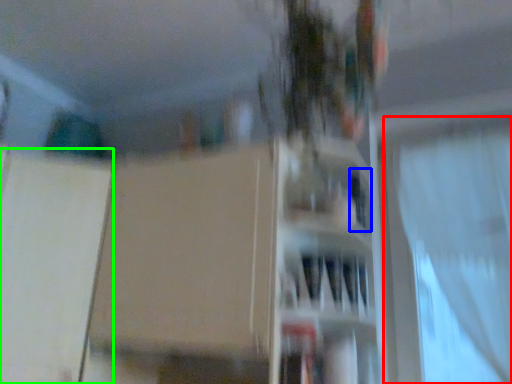
Question: Which object is the farthest from curtain (highlighted by a red box)? Choose among these: window (highlighted by a blue box) or screen door (highlighted by a green box).

Choices:
 (A) window
 (B) screen door

Answer: (B)